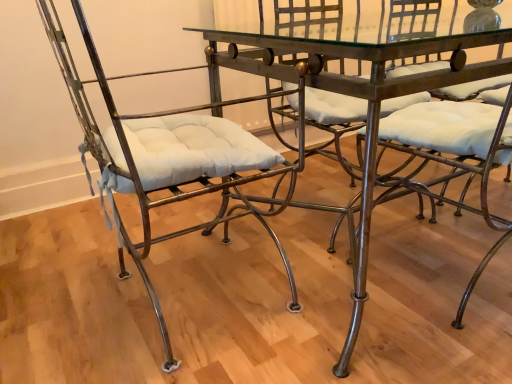
Question: Is metallic wrought iron chair at center, which ranks as the second chair in left-to-right order, aimed at metallic glass table at center?

Choices:
 (A) yes
 (B) no

Answer: (A)

Question: From a real-world perspective, is metallic wrought iron chair at center, which ranks as the second chair in left-to-right order, positioned over metallic glass table at center based on gravity?

Choices:
 (A) no
 (B) yes

Answer: (B)

Question: Can we say metallic wrought iron chair at center, which is the first chair in right-to-left order, lies outside metallic glass table at center?

Choices:
 (A) yes
 (B) no

Answer: (B)

Question: Is metallic wrought iron chair at center, which ranks as the second chair in left-to-right order, oriented away from metallic glass table at center?

Choices:
 (A) yes
 (B) no

Answer: (A)

Question: Is metallic wrought iron chair at center, which is the first chair in right-to-left order, placed right next to metallic glass table at center?

Choices:
 (A) no
 (B) yes

Answer: (A)

Question: Is metallic wrought iron chair at center, which is the first chair in right-to-left order, smaller than metallic glass table at center?

Choices:
 (A) yes
 (B) no

Answer: (A)

Question: Is matte metal chair at left, the 2th chair when ordered from right to left, wider than metallic wrought iron chair at center, which ranks as the second chair in left-to-right order?

Choices:
 (A) no
 (B) yes

Answer: (B)

Question: Is metallic wrought iron chair at center, which is the first chair in right-to-left order, completely or partially inside matte metal chair at left, the 2th chair when ordered from right to left?

Choices:
 (A) yes
 (B) no

Answer: (B)

Question: Is matte metal chair at left, the 2th chair when ordered from right to left, smaller than metallic wrought iron chair at center, which ranks as the second chair in left-to-right order?

Choices:
 (A) yes
 (B) no

Answer: (B)

Question: Is matte metal chair at left, the 2th chair when ordered from right to left, turned away from metallic wrought iron chair at center, which ranks as the second chair in left-to-right order?

Choices:
 (A) no
 (B) yes

Answer: (A)

Question: Is matte metal chair at left, the 2th chair when ordered from right to left, shorter than metallic wrought iron chair at center, which is the first chair in right-to-left order?

Choices:
 (A) yes
 (B) no

Answer: (B)

Question: From the image's perspective, is matte metal chair at left, the 2th chair when ordered from right to left, under metallic wrought iron chair at center, which ranks as the second chair in left-to-right order?

Choices:
 (A) no
 (B) yes

Answer: (B)

Question: Would you say metallic glass table at center is a long distance from metallic wrought iron chair at center, which ranks as the second chair in left-to-right order?

Choices:
 (A) yes
 (B) no

Answer: (B)